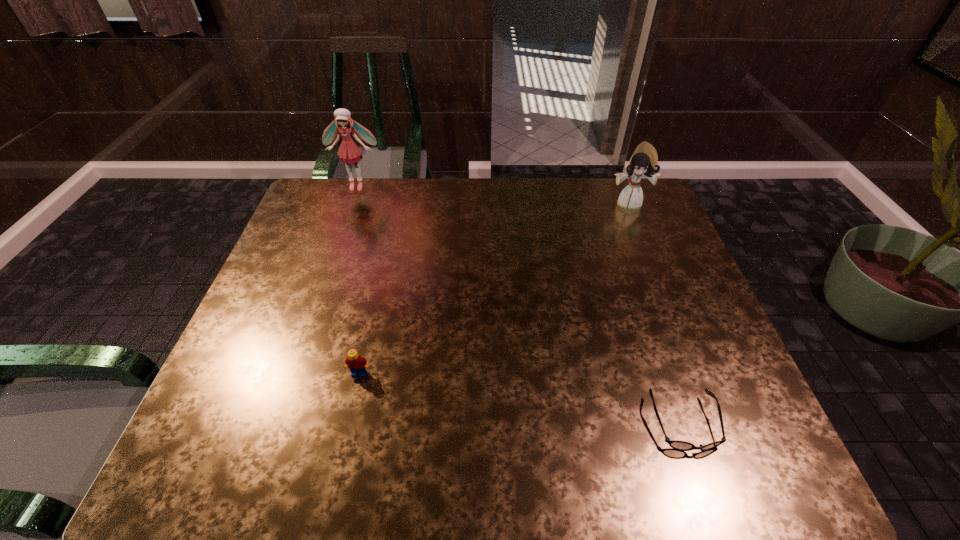
Locate an element on the screen. This screenshot has width=960, height=540. free space that is in between the leftmost object and the third shortest object is located at coordinates (492, 194).

The width and height of the screenshot is (960, 540). I want to click on free space between the second nearest object and the third shortest object, so click(493, 288).

At what (x,y) coordinates should I click in order to perform the action: click on empty space between the tallest object and the sunglasses. Please return your answer as a coordinate pair (x, y). Looking at the image, I should click on (520, 305).

Find the location of `free space between the farther doll and the shortest object`. free space between the farther doll and the shortest object is located at coordinates (520, 305).

Select which object is the third closest to the second tallest object. Please provide its 2D coordinates. Your answer should be formatted as a tuple, i.e. [(x, y)], where the tuple contains the x and y coordinates of a point satisfying the conditions above.

[(357, 364)]

Choose which object is the nearest neighbor to the second nearest object. Please provide its 2D coordinates. Your answer should be formatted as a tuple, i.e. [(x, y)], where the tuple contains the x and y coordinates of a point satisfying the conditions above.

[(675, 444)]